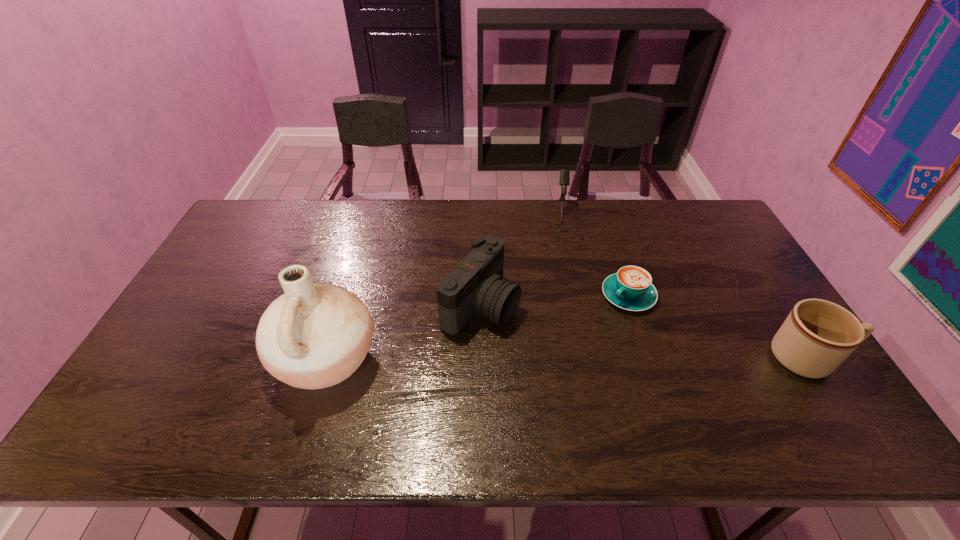
The width and height of the screenshot is (960, 540). Identify the location of the leftmost object. (314, 336).

The image size is (960, 540). I want to click on pottery, so click(x=314, y=336).

Locate an element on the screen. Image resolution: width=960 pixels, height=540 pixels. the rightmost object is located at coordinates (818, 335).

Find the location of a particular element. This screenshot has height=540, width=960. the shortest object is located at coordinates (631, 288).

Find the location of a particular element. Image resolution: width=960 pixels, height=540 pixels. the second object from left to right is located at coordinates [476, 286].

Identify the location of the second tallest object. Image resolution: width=960 pixels, height=540 pixels. (476, 286).

Find the location of a particular element. The image size is (960, 540). microphone is located at coordinates (564, 180).

This screenshot has height=540, width=960. What are the coordinates of `free space located 0.160m to pour from the handle of the leftmost object` in the screenshot? It's located at (212, 359).

The image size is (960, 540). I want to click on vacant space situated to pour from the handle of the leftmost object, so click(x=193, y=359).

This screenshot has height=540, width=960. I want to click on free space located to pour from the handle of the leftmost object, so click(x=220, y=359).